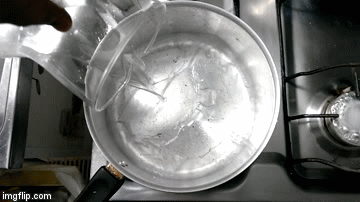
I want to click on base of pan, so click(189, 149).